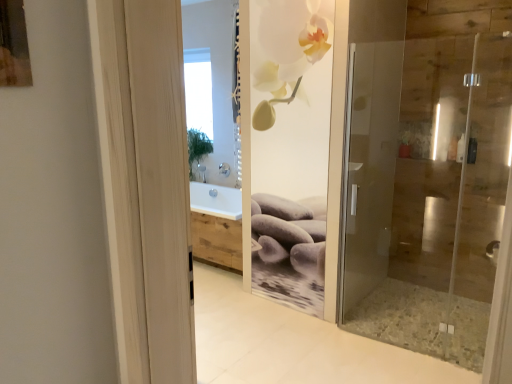
The height and width of the screenshot is (384, 512). Find the location of `transparent glass shower door at right`. transparent glass shower door at right is located at coordinates (428, 176).

This screenshot has height=384, width=512. Describe the element at coordinates (428, 176) in the screenshot. I see `transparent glass shower door at right` at that location.

What is the approximate width of transparent glass shower door at right?

The width of transparent glass shower door at right is 7.79 inches.

Find the location of a particular element. This screenshot has height=384, width=512. transparent glass window at upper center is located at coordinates (198, 92).

The image size is (512, 384). What do you see at coordinates (198, 92) in the screenshot?
I see `transparent glass window at upper center` at bounding box center [198, 92].

This screenshot has height=384, width=512. I want to click on transparent glass shower door at right, so click(428, 176).

Can you confirm if transparent glass window at upper center is positioned to the left of transparent glass shower door at right?

Yes, transparent glass window at upper center is to the left of transparent glass shower door at right.

In the image, is transparent glass window at upper center positioned in front of or behind transparent glass shower door at right?

In the image, transparent glass window at upper center appears behind transparent glass shower door at right.

Considering the positions of point (206, 137) and point (480, 268), is point (206, 137) closer or farther from the camera than point (480, 268)?

Clearly, point (206, 137) is more distant from the camera than point (480, 268).

From the image's perspective, is transparent glass window at upper center positioned above or below transparent glass shower door at right?

Clearly, from the image's perspective, transparent glass window at upper center is above transparent glass shower door at right.

In the scene shown: From a real-world perspective, is transparent glass window at upper center below transparent glass shower door at right?

Actually, transparent glass window at upper center is physically above transparent glass shower door at right in the real world.

Does transparent glass window at upper center have a greater width compared to transparent glass shower door at right?

In fact, transparent glass window at upper center might be narrower than transparent glass shower door at right.

Between transparent glass window at upper center and transparent glass shower door at right, which one has more height?

transparent glass shower door at right is taller.

Based on their sizes in the image, would you say transparent glass window at upper center is bigger or smaller than transparent glass shower door at right?

Clearly, transparent glass window at upper center is smaller in size than transparent glass shower door at right.

Is transparent glass shower door at right surrounded by transparent glass window at upper center?

Definitely not — transparent glass shower door at right is not inside transparent glass window at upper center.

Would you consider transparent glass window at upper center to be distant from transparent glass shower door at right?

Yes.

Is transparent glass window at upper center oriented towards transparent glass shower door at right?

No, transparent glass window at upper center is not facing towards transparent glass shower door at right.

Locate an element on the screen. The image size is (512, 384). door that appears on the right of transparent glass window at upper center is located at coordinates (428, 176).

Is transparent glass shower door at right at the left side of transparent glass window at upper center?

No, transparent glass shower door at right is not to the left of transparent glass window at upper center.

Is the depth of transparent glass shower door at right less than that of transparent glass window at upper center?

Yes, it is in front of transparent glass window at upper center.

Is point (391, 215) closer or farther from the camera than point (196, 90)?

Point (391, 215) appears to be closer to the viewer than point (196, 90).

From the image's perspective, which one is positioned lower, transparent glass shower door at right or transparent glass window at upper center?

From the image's view, transparent glass shower door at right is below.

From a real-world perspective, which object rests below the other?

transparent glass shower door at right.

Is transparent glass shower door at right wider than transparent glass window at upper center?

Yes.

Based on the photo, does transparent glass shower door at right have a greater height compared to transparent glass window at upper center?

Correct, transparent glass shower door at right is much taller as transparent glass window at upper center.

Who is bigger, transparent glass shower door at right or transparent glass window at upper center?

transparent glass shower door at right.

Do you think transparent glass shower door at right is within transparent glass window at upper center, or outside of it?

transparent glass shower door at right exists outside the volume of transparent glass window at upper center.

Does transparent glass shower door at right touch transparent glass window at upper center?

No, transparent glass shower door at right is not touching transparent glass window at upper center.

Is transparent glass shower door at right positioned with its back to transparent glass window at upper center?

No, transparent glass shower door at right is not facing the opposite direction of transparent glass window at upper center.

How far apart are transparent glass shower door at right and transparent glass window at upper center?

The distance of transparent glass shower door at right from transparent glass window at upper center is 2.38 meters.

Identify the location of window above the transparent glass shower door at right (from a real-world perspective). (198, 92).

Where is `window on the left of transparent glass shower door at right`? This screenshot has height=384, width=512. window on the left of transparent glass shower door at right is located at coordinates (198, 92).

Find the location of `door in front of the transparent glass window at upper center`. door in front of the transparent glass window at upper center is located at coordinates (428, 176).